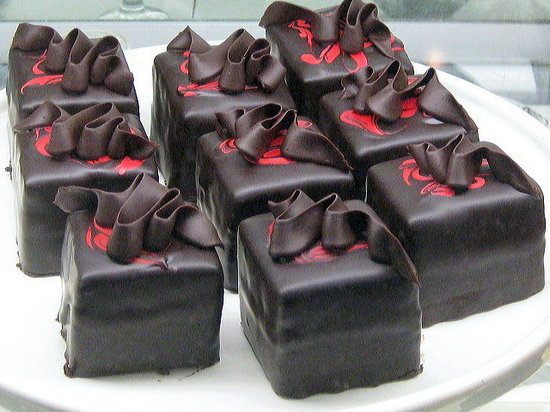
Image resolution: width=550 pixels, height=412 pixels. Identify the location of serving tray. (465, 349).